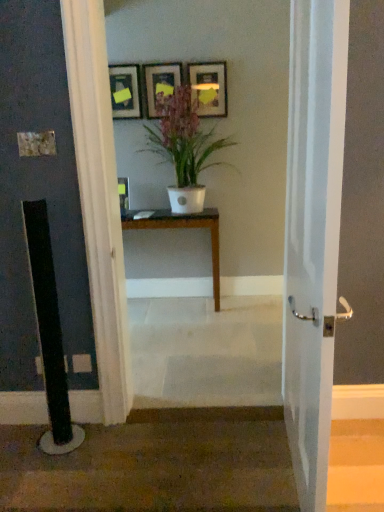
This screenshot has width=384, height=512. What are the coordinates of `free spot to the left of white glossy door at center` in the screenshot? It's located at (208, 473).